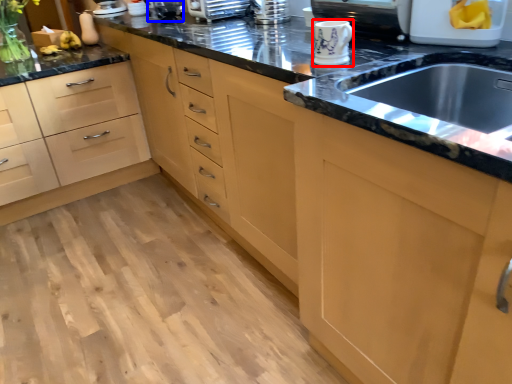
Question: Which of the following is the closest to the observer, appliance (highlighted by a red box) or appliance (highlighted by a blue box)?

Choices:
 (A) appliance
 (B) appliance

Answer: (A)